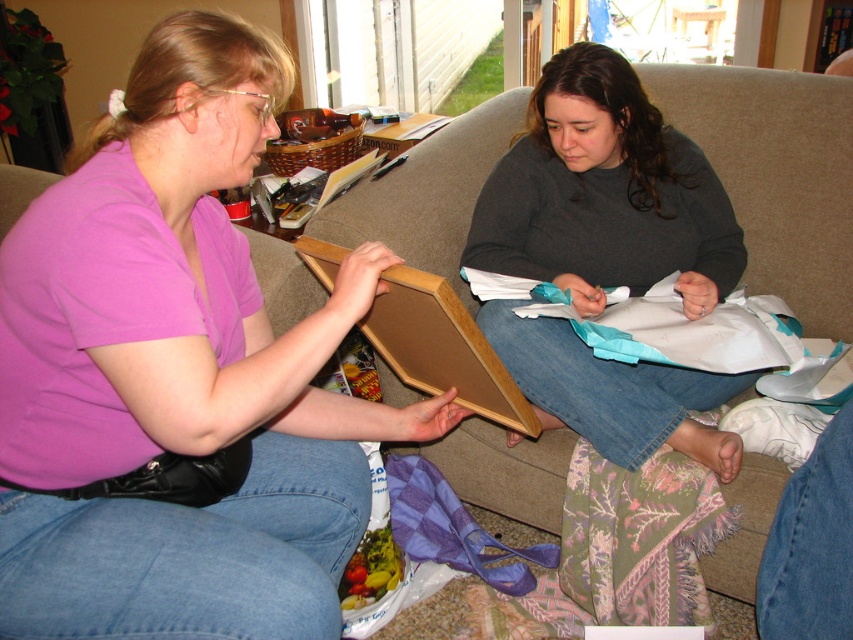
Is matte pink shirt at left positioned in front of beige fabric couch at center?

Result: Yes, matte pink shirt at left is in front of beige fabric couch at center.

Is point (65, 368) behind point (413, 168)?

No, it is not.

Is point (3, 272) more distant than point (531, 486)?

No, (3, 272) is in front of (531, 486).

Where is `matte pink shirt at left`? This screenshot has width=853, height=640. matte pink shirt at left is located at coordinates (177, 374).

Is dark gray sweater at center wider than beige fabric couch at center?

Indeed, dark gray sweater at center has a greater width compared to beige fabric couch at center.

Which is more to the right, dark gray sweater at center or beige fabric couch at center?

From the viewer's perspective, beige fabric couch at center appears more on the right side.

Between point (705, 244) and point (715, 570), which one is positioned behind?

The point (705, 244) is more distant.

At what (x,y) coordinates should I click in order to perform the action: click on dark gray sweater at center. Please return your answer as a coordinate pair (x, y). Looking at the image, I should click on (605, 193).

This screenshot has width=853, height=640. I want to click on matte pink shirt at left, so [177, 374].

Is matte pink shirt at left in front of dark gray sweater at center?

Yes, matte pink shirt at left is closer to the viewer.

Is point (80, 529) positioned after point (730, 260)?

No, (80, 529) is in front of (730, 260).

This screenshot has height=640, width=853. In order to click on matte pink shirt at left in this screenshot , I will do [177, 374].